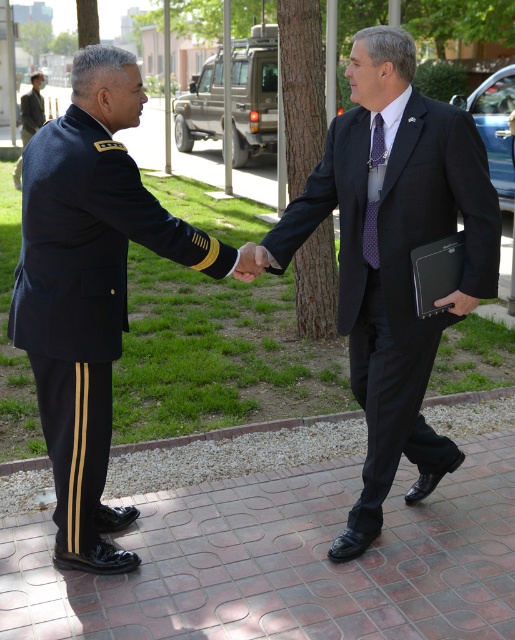
You are standing at the point marked as point (284, 561) in the image. What type of surface are you currently standing on?

You are standing on brick pavement at center.

Based on the photo, you are standing in the scene and want to walk from point (x=132, y=182) to point (x=430, y=452). Which direction should you move to get closer to your destination?

You should move away from the camera because point (x=430, y=452) is further to the camera than point (x=132, y=182).